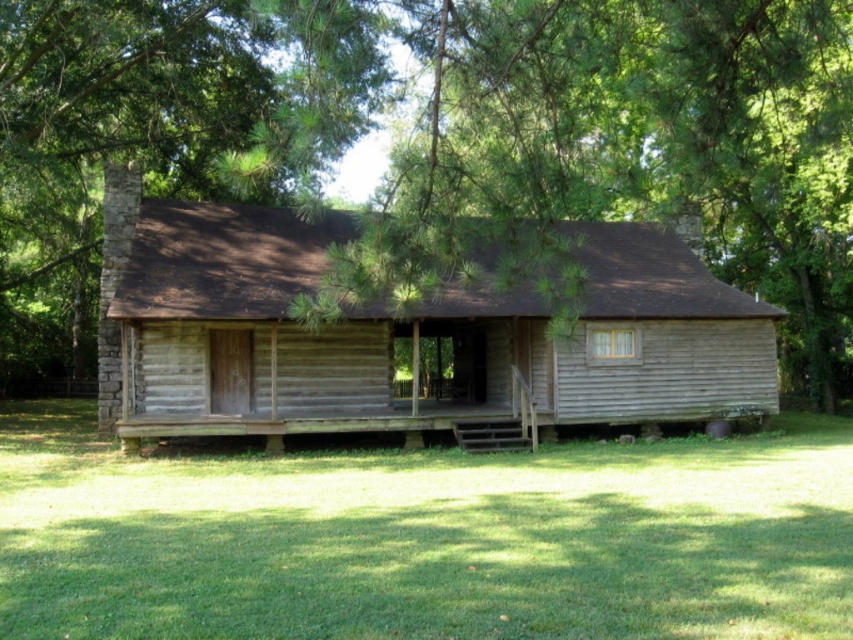
You are planning to take a photo of the weathered wood cabin at center and the green leafy tree at center from a distance. Which object will appear bigger in the photo?

The green leafy tree at center will appear bigger in the photo because it is larger in size than the weathered wood cabin at center.

You are standing on the front porch of the weathered wood cabin at center and want to look at the green leafy tree at center. In which direction should you turn your head?

The green leafy tree at center is positioned on the left side of weathered wood cabin at center, so you should turn your head to the left to look at the green leafy tree at center.

You are standing at the entrance of the rustic log cabin and want to walk to the stone chimney on the left side. There are two points marked on the ground, point 1 at coordinates point [68,113] and point 2 at coordinates point [152,269]. Which point should you step on first if you want to follow the path that goes behind the second point?

You should step on point [152,269] first because point [68,113] is behind it, so following the path that goes behind the second point requires starting at the second point.